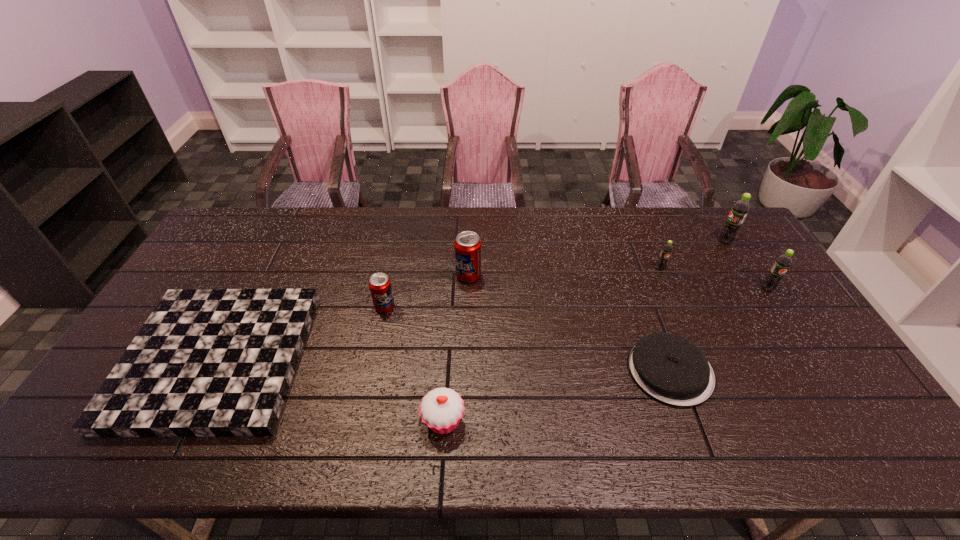
Where is `the farthest soda`? This screenshot has width=960, height=540. the farthest soda is located at coordinates (740, 209).

In order to click on the biggest green soda in this screenshot , I will do `click(740, 209)`.

Image resolution: width=960 pixels, height=540 pixels. What are the coordinates of `the second smallest green soda` in the screenshot? It's located at (780, 267).

Locate an element on the screen. Image resolution: width=960 pixels, height=540 pixels. the farther red soda can is located at coordinates (467, 245).

The image size is (960, 540). I want to click on the right red soda can, so click(467, 245).

You are a GUI agent. You are given a task and a screenshot of the screen. Output one action in this format:
    pyautogui.click(x=<x>, y=<y>)
    Task: Click on the smaller red soda can
    The height and width of the screenshot is (540, 960).
    Given the screenshot: What is the action you would take?
    pyautogui.click(x=380, y=286)

Where is `the seventh object from right to left`? the seventh object from right to left is located at coordinates (380, 286).

Where is `the second farthest green soda`? This screenshot has width=960, height=540. the second farthest green soda is located at coordinates (666, 251).

At what (x,y) coordinates should I click in order to perform the action: click on the third soda from left to right. Please return your answer as a coordinate pair (x, y). The image size is (960, 540). Looking at the image, I should click on (666, 251).

Where is `pink cupcake`? Image resolution: width=960 pixels, height=540 pixels. pink cupcake is located at coordinates (441, 410).